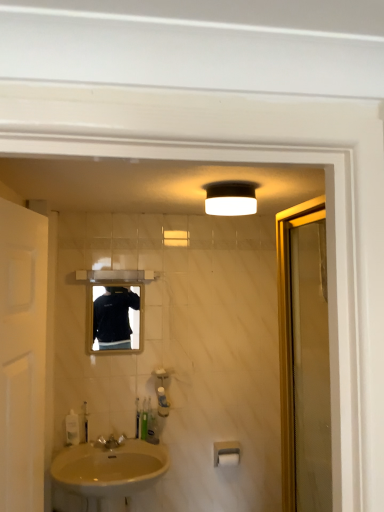
You are a GUI agent. You are given a task and a screenshot of the screen. Output one action in this format:
    pyautogui.click(x=<x>, y=<y>)
    Task: Click on the free region on the left part of translucent plastic soap dispenser at lower center, the 3th toiletry viewed from the left
    This screenshot has height=512, width=384.
    Given the screenshot: What is the action you would take?
    pyautogui.click(x=116, y=443)